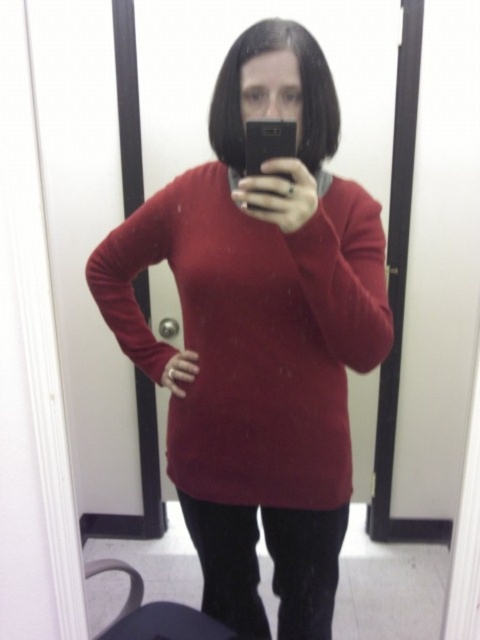
Question: Which object appears closest to the camera in this image?

Choices:
 (A) black glossy phone at upper center
 (B) matte red sweater at center

Answer: (A)

Question: Does matte red sweater at center appear on the left side of black glossy phone at upper center?

Choices:
 (A) yes
 (B) no

Answer: (A)

Question: Is matte red sweater at center wider than black glossy phone at upper center?

Choices:
 (A) no
 (B) yes

Answer: (B)

Question: Is matte red sweater at center below black glossy phone at upper center?

Choices:
 (A) no
 (B) yes

Answer: (B)

Question: Which object is farther from the camera taking this photo?

Choices:
 (A) matte red sweater at center
 (B) black glossy phone at upper center

Answer: (A)